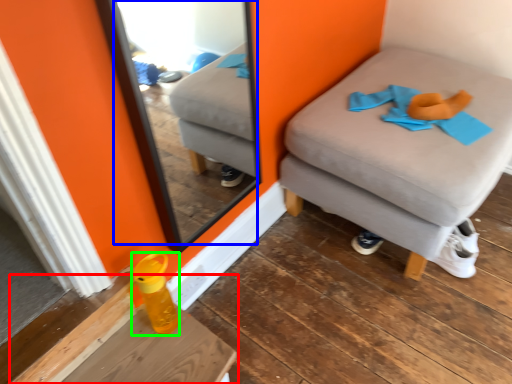
Question: Which object is the closest to the table (highlighted by a red box)? Choose among these: mirror (highlighted by a blue box) or bottle (highlighted by a green box).

Choices:
 (A) mirror
 (B) bottle

Answer: (B)